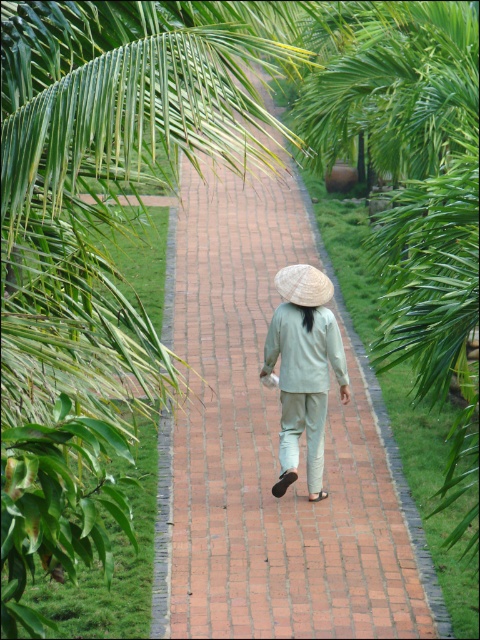
You are standing at the start of the brick pathway and see the brick pavement at center and the white straw hat at center. Which object is closer to your left side?

The brick pavement at center is to the left of the white straw hat at center, so the brick pavement at center is closer to your left side.

You are a photographer trying to capture the brick pavement at center and the white straw hat at center in a single frame. Based on their widths, which object should you focus on to ensure both fit in the frame?

The brick pavement at center is wider than the white straw hat at center, so focusing on the brick pavement at center ensures both objects fit in the frame.